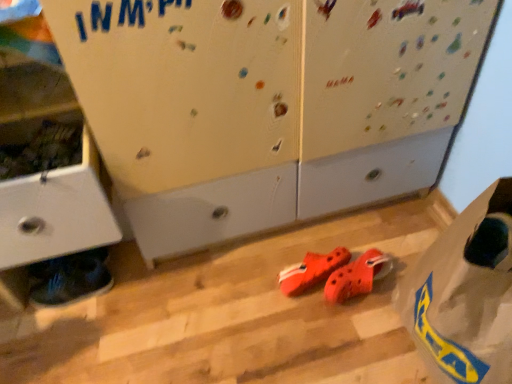
At what (x,y) coordinates should I click in order to perform the action: click on matte white cabinet at left. Please return your answer as a coordinate pair (x, y). The height and width of the screenshot is (384, 512). Looking at the image, I should click on (49, 175).

The width and height of the screenshot is (512, 384). What do you see at coordinates (466, 294) in the screenshot?
I see `transparent plastic bag at lower right` at bounding box center [466, 294].

Identify the location of orange rubber clogs at center, placed as the first footwear when sorted from right to left. (357, 276).

In the image, is shiny blue sneakers at lower left, positioned as the 1th footwear in left-to-right order, positioned in front of or behind transparent plastic bag at lower right?

shiny blue sneakers at lower left, positioned as the 1th footwear in left-to-right order, is positioned farther from the viewer than transparent plastic bag at lower right.

Do you think shiny blue sneakers at lower left, positioned as the 1th footwear in left-to-right order, is within transparent plastic bag at lower right, or outside of it?

shiny blue sneakers at lower left, positioned as the 1th footwear in left-to-right order, is not enclosed by transparent plastic bag at lower right.

From the image's perspective, is shiny blue sneakers at lower left, which appears as the third footwear when viewed from the right, on top of transparent plastic bag at lower right?

No, from the image's perspective, shiny blue sneakers at lower left, which appears as the third footwear when viewed from the right, is not on top of transparent plastic bag at lower right.

Looking at the image, does orange rubber clogs at center, placed as the first footwear when sorted from right to left, seem bigger or smaller compared to shiny blue sneakers at lower left, positioned as the 1th footwear in left-to-right order?

Considering their sizes, orange rubber clogs at center, placed as the first footwear when sorted from right to left, takes up less space than shiny blue sneakers at lower left, positioned as the 1th footwear in left-to-right order.

Considering the positions of objects orange rubber clogs at center, the 3th footwear in the left-to-right sequence, and shiny blue sneakers at lower left, which appears as the third footwear when viewed from the right, in the image provided, who is more to the right, orange rubber clogs at center, the 3th footwear in the left-to-right sequence, or shiny blue sneakers at lower left, which appears as the third footwear when viewed from the right,?

From the viewer's perspective, orange rubber clogs at center, the 3th footwear in the left-to-right sequence, appears more on the right side.

Is shiny blue sneakers at lower left, which appears as the third footwear when viewed from the right, a part of orange rubber clogs at center, placed as the first footwear when sorted from right to left?

Definitely not — shiny blue sneakers at lower left, which appears as the third footwear when viewed from the right, is not inside orange rubber clogs at center, placed as the first footwear when sorted from right to left.

Does orange rubber clogs at center, the 3th footwear in the left-to-right sequence, have a lesser height compared to matte white cabinet at left?

Correct, orange rubber clogs at center, the 3th footwear in the left-to-right sequence, is not as tall as matte white cabinet at left.

Is orange rubber clogs at center, the 3th footwear in the left-to-right sequence, wider or thinner than matte white cabinet at left?

orange rubber clogs at center, the 3th footwear in the left-to-right sequence, is thinner than matte white cabinet at left.

From the image's perspective, between orange rubber clogs at center, placed as the first footwear when sorted from right to left, and matte white cabinet at left, who is located below?

orange rubber clogs at center, placed as the first footwear when sorted from right to left, appears lower in the image.

Starting from the matte white cabinet at left, which footwear is the 1st one behind? Please provide its 2D coordinates.

[(357, 276)]

Looking at this image, is rubber/crocodile-patterned shoes at center, placed as the 2th footwear when sorted from right to left, bigger or smaller than transparent plastic bag at lower right?

Clearly, rubber/crocodile-patterned shoes at center, placed as the 2th footwear when sorted from right to left, is smaller in size than transparent plastic bag at lower right.

Are rubber/crocodile-patterned shoes at center, the 2th footwear positioned from the left, and transparent plastic bag at lower right located far from each other?

No, rubber/crocodile-patterned shoes at center, the 2th footwear positioned from the left, is not far from transparent plastic bag at lower right.

Is rubber/crocodile-patterned shoes at center, the 2th footwear positioned from the left, thinner than transparent plastic bag at lower right?

Yes, rubber/crocodile-patterned shoes at center, the 2th footwear positioned from the left, is thinner than transparent plastic bag at lower right.

Is matte white cabinet at left not inside shiny blue sneakers at lower left, positioned as the 1th footwear in left-to-right order?

Yes.

Between matte white cabinet at left and shiny blue sneakers at lower left, which appears as the third footwear when viewed from the right, which one has less height?

shiny blue sneakers at lower left, which appears as the third footwear when viewed from the right.

From the image's perspective, is matte white cabinet at left positioned above or below shiny blue sneakers at lower left, positioned as the 1th footwear in left-to-right order?

Clearly, from the image's perspective, matte white cabinet at left is above shiny blue sneakers at lower left, positioned as the 1th footwear in left-to-right order.

How far apart are matte white cabinet at left and shiny blue sneakers at lower left, which appears as the third footwear when viewed from the right?

matte white cabinet at left is 11.42 inches from shiny blue sneakers at lower left, which appears as the third footwear when viewed from the right.

Does transparent plastic bag at lower right appear on the right side of matte white cabinet at left?

Yes.

Is transparent plastic bag at lower right next to matte white cabinet at left and touching it?

No, transparent plastic bag at lower right is not beside matte white cabinet at left.

From the image's perspective, between transparent plastic bag at lower right and matte white cabinet at left, which one is located above?

From the image's view, matte white cabinet at left is above.

Considering the relative positions of matte white cabinet at left and transparent plastic bag at lower right in the image provided, is matte white cabinet at left behind transparent plastic bag at lower right?

Yes, matte white cabinet at left is behind transparent plastic bag at lower right.

Are matte white cabinet at left and transparent plastic bag at lower right far apart?

No, matte white cabinet at left is not far away from transparent plastic bag at lower right.

Considering the points (40, 184) and (489, 253), which point is in front, point (40, 184) or point (489, 253)?

The point (489, 253) is closer to the camera.

I want to click on cabinetry above the transparent plastic bag at lower right (from the image's perspective), so click(x=49, y=175).

Where is `paper bag above the shiny blue sneakers at lower left, which appears as the third footwear when viewed from the right (from a real-world perspective)`? Image resolution: width=512 pixels, height=384 pixels. paper bag above the shiny blue sneakers at lower left, which appears as the third footwear when viewed from the right (from a real-world perspective) is located at coordinates (466, 294).

This screenshot has width=512, height=384. I want to click on the 2nd footwear to the right of the shiny blue sneakers at lower left, positioned as the 1th footwear in left-to-right order, counting from the anchor's position, so click(x=357, y=276).

From the image, which object appears to be farther from matte white cabinet at left, shiny blue sneakers at lower left, positioned as the 1th footwear in left-to-right order, or transparent plastic bag at lower right?

Among the two, transparent plastic bag at lower right is located further to matte white cabinet at left.

Considering their positions, is transparent plastic bag at lower right positioned further to matte white cabinet at left than orange rubber clogs at center, the 3th footwear in the left-to-right sequence?

transparent plastic bag at lower right lies further to matte white cabinet at left than the other object.

In the scene shown: When comparing their distances from orange rubber clogs at center, placed as the first footwear when sorted from right to left, does matte white cabinet at left or shiny blue sneakers at lower left, positioned as the 1th footwear in left-to-right order, seem further?

matte white cabinet at left.

Which object lies further to the anchor point shiny blue sneakers at lower left, which appears as the third footwear when viewed from the right, orange rubber clogs at center, placed as the first footwear when sorted from right to left, or transparent plastic bag at lower right?

transparent plastic bag at lower right lies further to shiny blue sneakers at lower left, which appears as the third footwear when viewed from the right, than the other object.

Looking at the image, which one is located closer to shiny blue sneakers at lower left, which appears as the third footwear when viewed from the right, rubber/crocodile-patterned shoes at center, the 2th footwear positioned from the left, or transparent plastic bag at lower right?

The object closer to shiny blue sneakers at lower left, which appears as the third footwear when viewed from the right, is rubber/crocodile-patterned shoes at center, the 2th footwear positioned from the left.

Based on their spatial positions, is rubber/crocodile-patterned shoes at center, placed as the 2th footwear when sorted from right to left, or shiny blue sneakers at lower left, which appears as the third footwear when viewed from the right, closer to orange rubber clogs at center, placed as the first footwear when sorted from right to left?

Based on the image, rubber/crocodile-patterned shoes at center, placed as the 2th footwear when sorted from right to left, appears to be nearer to orange rubber clogs at center, placed as the first footwear when sorted from right to left.

When comparing their distances from shiny blue sneakers at lower left, positioned as the 1th footwear in left-to-right order, does transparent plastic bag at lower right or matte white cabinet at left seem further?

Among the two, transparent plastic bag at lower right is located further to shiny blue sneakers at lower left, positioned as the 1th footwear in left-to-right order.

In the scene shown: Considering their positions, is rubber/crocodile-patterned shoes at center, placed as the 2th footwear when sorted from right to left, positioned closer to orange rubber clogs at center, placed as the first footwear when sorted from right to left, than transparent plastic bag at lower right?

rubber/crocodile-patterned shoes at center, placed as the 2th footwear when sorted from right to left, is positioned closer to the anchor orange rubber clogs at center, placed as the first footwear when sorted from right to left.

What are the coordinates of `footwear located between shiny blue sneakers at lower left, positioned as the 1th footwear in left-to-right order, and orange rubber clogs at center, placed as the first footwear when sorted from right to left, in the left-right direction` in the screenshot? It's located at (311, 271).

Locate an element on the screen. footwear between matte white cabinet at left and rubber/crocodile-patterned shoes at center, placed as the 2th footwear when sorted from right to left, in the horizontal direction is located at coordinates (70, 278).

In order to click on footwear located between transparent plastic bag at lower right and rubber/crocodile-patterned shoes at center, the 2th footwear positioned from the left, in the depth direction in this screenshot , I will do `click(357, 276)`.